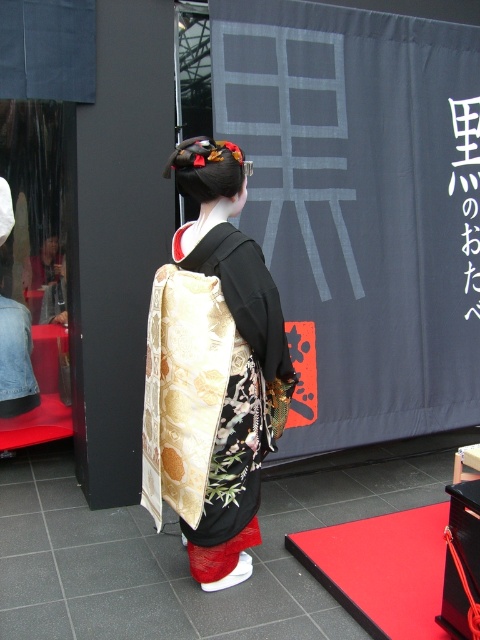
Can you confirm if silky gold kimono at center is shorter than black paper at upper center?

No, silky gold kimono at center is not shorter than black paper at upper center.

Based on the photo, can you confirm if silky gold kimono at center is thinner than black paper at upper center?

No.

Which is in front, point (204, 374) or point (468, 243)?

Positioned in front is point (204, 374).

You are a GUI agent. You are given a task and a screenshot of the screen. Output one action in this format:
    pyautogui.click(x=<x>, y=<y>)
    Task: Click on the silky gold kimono at center
    The width and height of the screenshot is (480, 640).
    Given the screenshot: What is the action you would take?
    pyautogui.click(x=214, y=372)

Is silky gold kimono at center further to the viewer compared to red carpet at lower right?

Yes, it is.

Does point (178, 416) come behind point (424, 541)?

No, it is not.

You are a GUI agent. You are given a task and a screenshot of the screen. Output one action in this format:
    pyautogui.click(x=<x>, y=<y>)
    Task: Click on the silky gold kimono at center
    
    Given the screenshot: What is the action you would take?
    pyautogui.click(x=214, y=372)

Which of these two, red carpet at lower right or black paper at upper center, stands taller?

Standing taller between the two is black paper at upper center.

Is the position of red carpet at lower right less distant than that of black paper at upper center?

Yes, it is.

Where is `red carpet at lower right`? The height and width of the screenshot is (640, 480). red carpet at lower right is located at coordinates (383, 570).

Identify the location of red carpet at lower right. (383, 570).